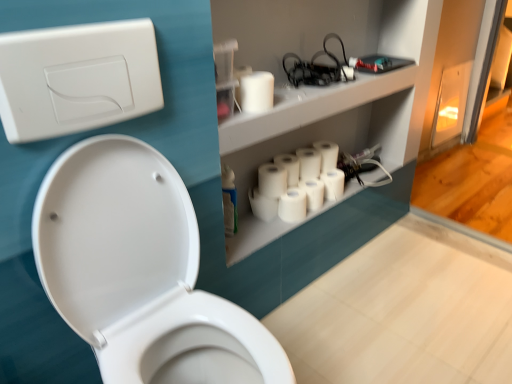
Question: From the image's perspective, does white matte toilet paper at upper center, the ninth toilet paper from the back, appear higher than white matte toilet paper at center, positioned as the sixth toilet paper in front-to-back order?

Choices:
 (A) no
 (B) yes

Answer: (B)

Question: Does white matte toilet paper at upper center, the 1th toilet paper positioned from the front, have a lesser height compared to white matte toilet paper at center, positioned as the sixth toilet paper in front-to-back order?

Choices:
 (A) no
 (B) yes

Answer: (B)

Question: Is white matte toilet paper at center, positioned as the sixth toilet paper in front-to-back order, at the back of white matte toilet paper at upper center, the 1th toilet paper positioned from the front?

Choices:
 (A) no
 (B) yes

Answer: (A)

Question: Does white matte toilet paper at upper center, the 1th toilet paper positioned from the front, appear on the left side of white matte toilet paper at center, the 4th toilet paper viewed from the back?

Choices:
 (A) no
 (B) yes

Answer: (B)

Question: Can you confirm if white matte toilet paper at upper center, the ninth toilet paper from the back, is positioned to the right of white matte toilet paper at center, the 4th toilet paper viewed from the back?

Choices:
 (A) no
 (B) yes

Answer: (A)

Question: Considering the relative positions of white plastic/light switch at upper left and white matte toilet paper at center, the fifth toilet paper in the front-to-back sequence, in the image provided, is white plastic/light switch at upper left to the left or to the right of white matte toilet paper at center, the fifth toilet paper in the front-to-back sequence,?

Choices:
 (A) left
 (B) right

Answer: (A)

Question: Relative to white matte toilet paper at center, acting as the 5th toilet paper starting from the back, is white plastic/light switch at upper left in front or behind?

Choices:
 (A) front
 (B) behind

Answer: (A)

Question: Is white plastic/light switch at upper left situated inside white matte toilet paper at center, the fifth toilet paper in the front-to-back sequence, or outside?

Choices:
 (A) outside
 (B) inside

Answer: (A)

Question: In terms of width, does white plastic/light switch at upper left look wider or thinner when compared to white matte toilet paper at center, acting as the 5th toilet paper starting from the back?

Choices:
 (A) thin
 (B) wide

Answer: (A)

Question: In terms of width, does white matte toilet paper at center, the 4th toilet paper viewed from the back, look wider or thinner when compared to white matte toilet paper at center, acting as the 5th toilet paper starting from the back?

Choices:
 (A) thin
 (B) wide

Answer: (A)

Question: Based on their sizes in the image, would you say white matte toilet paper at center, the 4th toilet paper viewed from the back, is bigger or smaller than white matte toilet paper at center, the fifth toilet paper in the front-to-back sequence?

Choices:
 (A) small
 (B) big

Answer: (A)

Question: From the image's perspective, is white matte toilet paper at center, the 4th toilet paper viewed from the back, located above or below white matte toilet paper at center, acting as the 5th toilet paper starting from the back?

Choices:
 (A) below
 (B) above

Answer: (A)

Question: Based on their positions, is white matte toilet paper at center, the 4th toilet paper viewed from the back, located to the left or right of white matte toilet paper at center, acting as the 5th toilet paper starting from the back?

Choices:
 (A) right
 (B) left

Answer: (A)

Question: From a real-world perspective, relative to white matte toilet paper at center, which is the seventh toilet paper from back to front, is white matte toilet paper at center, acting as the 3th toilet paper starting from the back, vertically above or below?

Choices:
 (A) above
 (B) below

Answer: (A)

Question: Considering the relative positions of white matte toilet paper at center, acting as the 3th toilet paper starting from the back, and white matte toilet paper at center, placed as the 3th toilet paper when sorted from front to back, in the image provided, is white matte toilet paper at center, acting as the 3th toilet paper starting from the back, to the left or to the right of white matte toilet paper at center, placed as the 3th toilet paper when sorted from front to back,?

Choices:
 (A) right
 (B) left

Answer: (A)